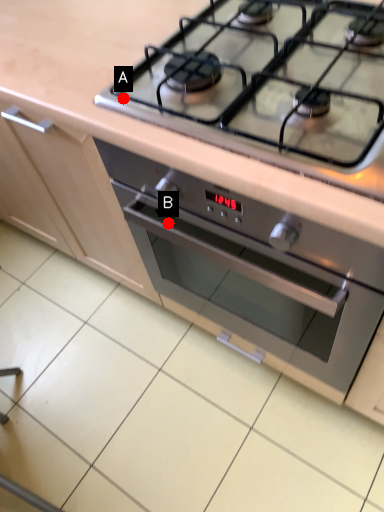
Question: Two points are circled on the image, labeled by A and B beside each circle. Which point is farther to the camera?

Choices:
 (A) A is further
 (B) B is further

Answer: (B)